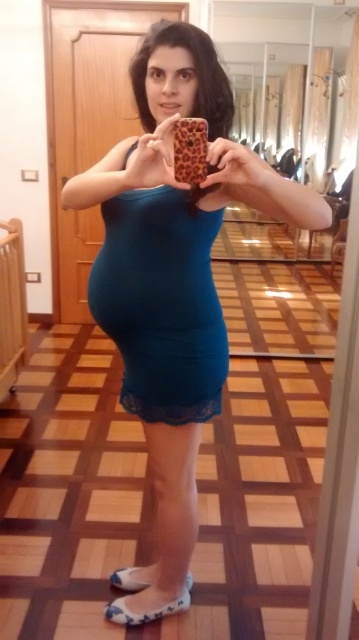
You are a photographer trying to capture the best angle of the person in the image. Since the blue fabric sandal at lower center and the white fabric sandal at lower center are both visible, which sandal should you focus on to ensure it appears larger in the photo?

The blue fabric sandal at lower center is closer to the viewer than the white fabric sandal at lower center, so focusing on it will make it appear larger in the photo.

You are a fashion designer analyzing the image of a person wearing two teal dresses. The dresses are labeled as the teal fabric dress at center and the teal matte dress at center. Based on the scene description, which dress is longer?

The teal fabric dress at center is longer than the teal matte dress at center.

You are trying to choose between the blue fabric sandal at lower center and the white fabric sandal at lower center for a formal event. Which sandal is narrower?

The blue fabric sandal at lower center is narrower than the white fabric sandal at lower center.